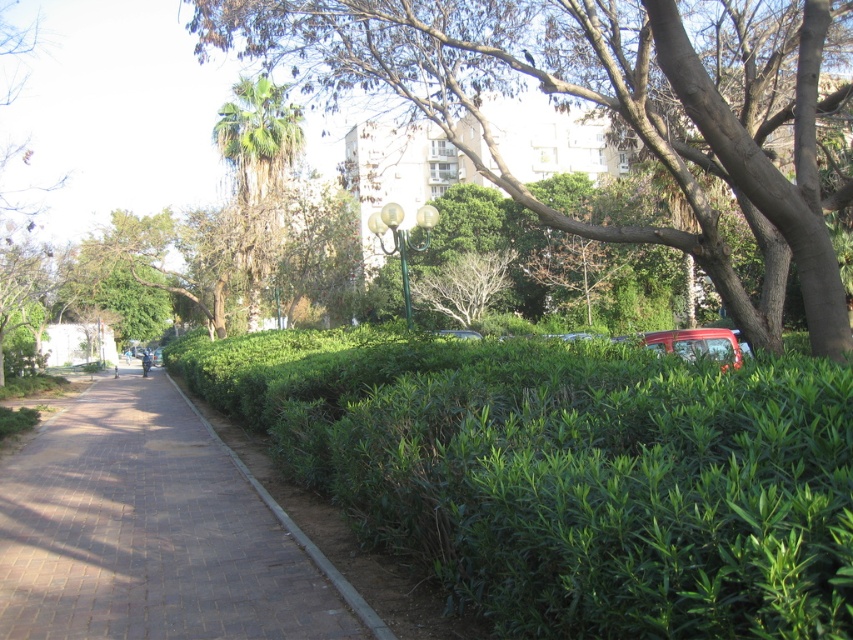
You are a city planner analyzing this park layout. Based on the scene, which tree is shorter between the green leafy tree at center and the green leafy palm tree at center?

The green leafy tree at center is shorter than the green leafy palm tree at center according to the description.

You are a pedestrian walking on the brick paved sidewalk at center. There is a green leafy tree at center above you. Can you walk directly under the tree without stepping off the sidewalk?

Yes, because the green leafy tree at center is positioned over the brick paved sidewalk at center, so the sidewalk runs directly underneath it, allowing you to walk under the tree while staying on the sidewalk.

You are a city planner assessing the park layout. You need to determine if the green leafy tree at center has a larger canopy spread than the green leafy palm tree at center. Based on the scene, what can you conclude?

The green leafy tree at center has a larger canopy spread than the green leafy palm tree at center because its width surpasses the palm tree.